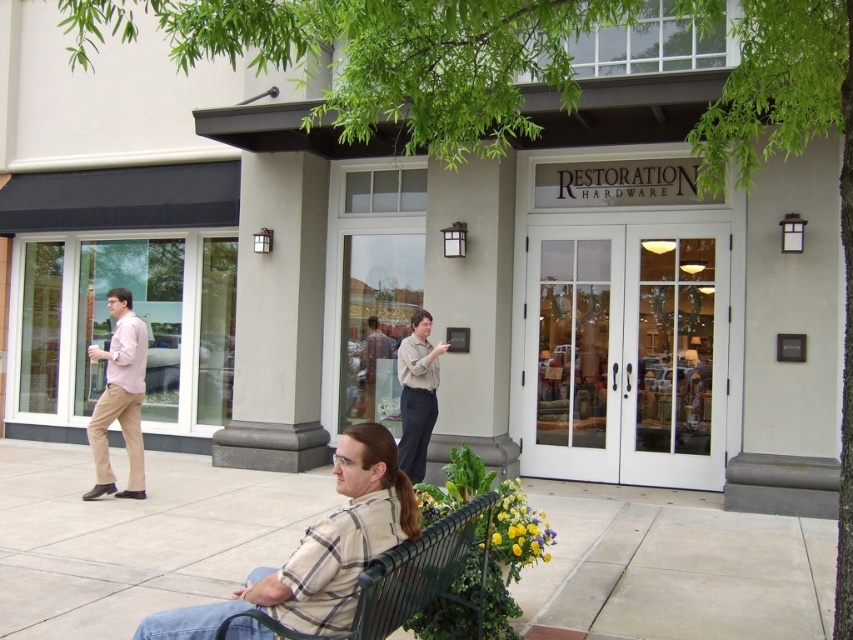
Question: From the image, what is the correct spatial relationship of plaid shirt at center in relation to light brown shirt at center?

Choices:
 (A) above
 (B) below

Answer: (B)

Question: Can you confirm if green metal bench at lower center is positioned to the right of light brown shirt at center?

Choices:
 (A) no
 (B) yes

Answer: (B)

Question: Estimate the real-world distances between objects in this image. Which object is farther from the plaid shirt at center?

Choices:
 (A) light pink shirt at left
 (B) light brown shirt at center

Answer: (A)

Question: Among these objects, which one is nearest to the camera?

Choices:
 (A) green concrete bench at lower center
 (B) light brown leather jacket at center
 (C) green metal bench at lower center
 (D) plaid shirt at center

Answer: (C)

Question: Is green metal bench at lower center positioned behind light brown shirt at center?

Choices:
 (A) yes
 (B) no

Answer: (B)

Question: Which point is closer to the camera?

Choices:
 (A) light brown shirt at center
 (B) green concrete bench at lower center
 (C) plaid shirt at center
 (D) light brown leather jacket at center

Answer: (C)